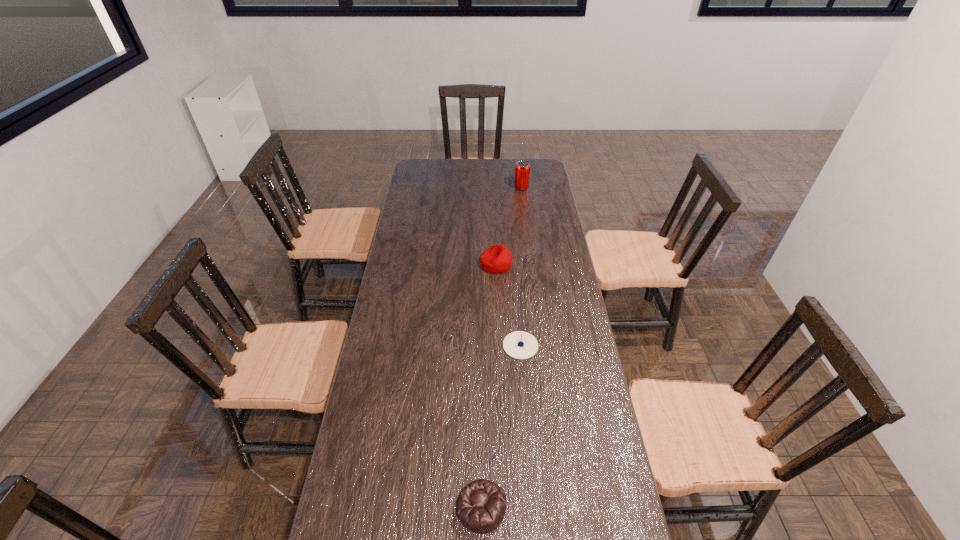
Where is `free space located on the seat area of the taller beanbag`? The height and width of the screenshot is (540, 960). free space located on the seat area of the taller beanbag is located at coordinates (412, 264).

You are a GUI agent. You are given a task and a screenshot of the screen. Output one action in this format:
    pyautogui.click(x=<x>, y=<y>)
    Task: Click on the vacant space located on the back of the compass
    
    Given the screenshot: What is the action you would take?
    pyautogui.click(x=515, y=274)

This screenshot has height=540, width=960. In order to click on vacant region located on the right of the shorter beanbag in this screenshot , I will do `click(530, 507)`.

The image size is (960, 540). In order to click on object that is positioned at the right edge in this screenshot , I will do `click(522, 169)`.

Where is `free space at the far edge of the desktop`? free space at the far edge of the desktop is located at coordinates (461, 176).

Where is `vacant area at the left edge of the desktop`? This screenshot has height=540, width=960. vacant area at the left edge of the desktop is located at coordinates (396, 461).

In the image, there is a desktop. Identify the location of vacant space at the right edge. (557, 205).

At what (x,y) coordinates should I click in order to perform the action: click on unoccupied position between the compass and the farther beanbag. Please return your answer as a coordinate pair (x, y). Looking at the image, I should click on [x=509, y=305].

What are the coordinates of `vacant space in between the third shortest object and the third farthest object` in the screenshot? It's located at [509, 305].

At what (x,y) coordinates should I click in order to perform the action: click on blank region between the farther beanbag and the shorter beanbag. Please return your answer as a coordinate pair (x, y). Looking at the image, I should click on (489, 386).